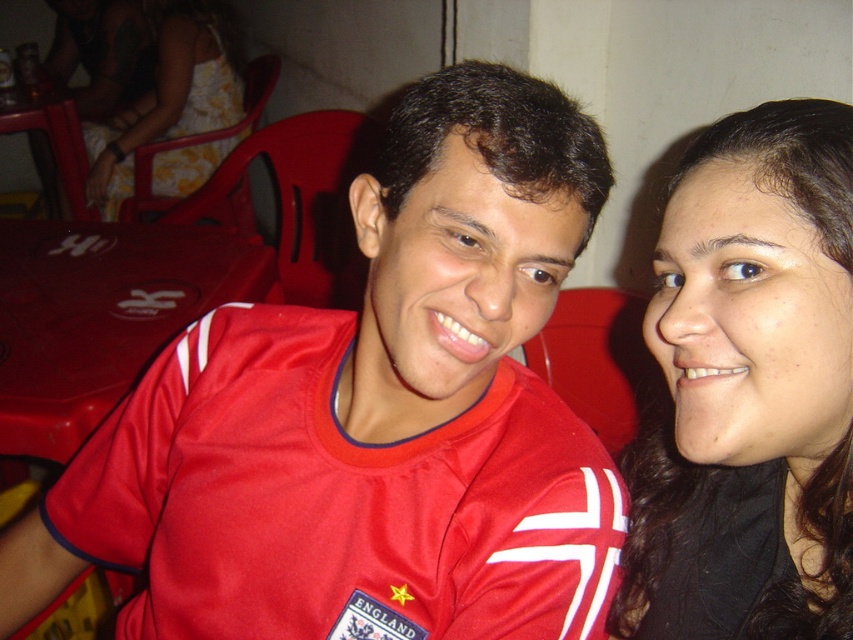
You are a photographer trying to capture a portrait of both individuals in the scene. Since you want to ensure the matte red jersey at center and the black matte hair at upper right are both clearly visible, which direction should you position your camera relative to the subjects?

The matte red jersey at center is to the left of the black matte hair at upper right, so positioning the camera to the right side of the subjects will ensure both are clearly visible.

You are a photographer trying to capture a candid shot of two people sitting at a table. The two people are located at point (543, 412). If your camera has a minimum focus distance of 25 inches, will you be able to clearly capture both individuals in focus?

The two people are 27.04 inches apart, so if the camera has a minimum focus distance of 25 inches, the distance between them exceeds the minimum focus distance. Therefore, both individuals should be in focus as long as they are within the camera lens range.

You are a photographer trying to capture a clear shot of both the matte red jersey at center and the yellow floral dress at upper left. Which object should you focus on first to ensure it appears in focus given their positions?

The matte red jersey at center has a lesser height compared to the yellow floral dress at upper left, so you should focus on the yellow floral dress at upper left first to ensure it stays in focus since it is taller.